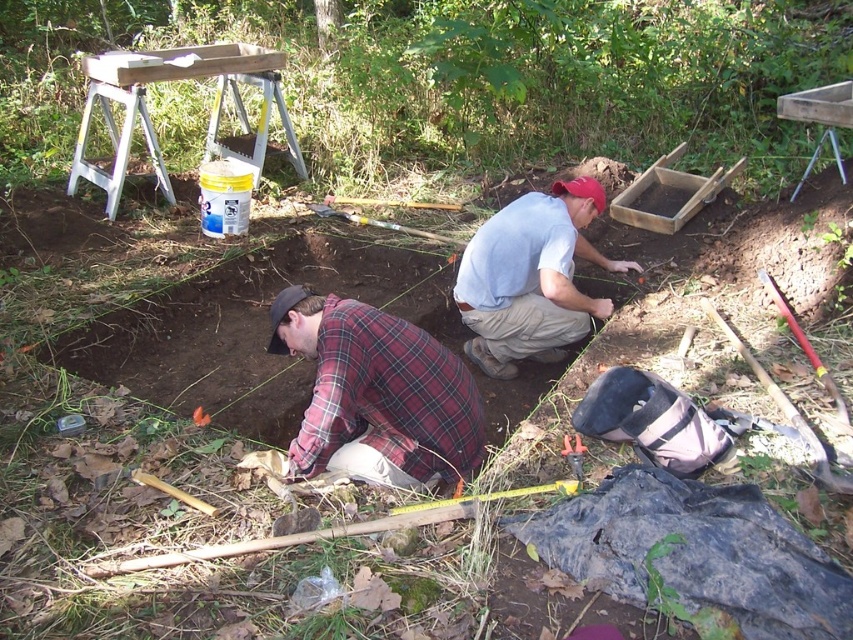
You are a photographer standing at the center of the excavation site. You want to take a photo that includes both the plaid fabric shirt at lower left and the other person in the scene. Which direction should you move to ensure both are in the frame?

To include both the plaid fabric shirt at lower left and the other person in the frame, you should move to the right since the plaid fabric shirt at lower left is located at point (376, 394), which is towards the lower left side of the image. Moving right would center the photographer between both individuals, ensuring both are captured in the frame.

Based on the coordinates provided, which object in the scene is located at point (376, 394)?

The point (376, 394) corresponds to the plaid fabric shirt at lower left.

You are an archaeologist who needs to identify the correct tool for a task. You have a white cotton shirt at center and a metallic silver hammer at lower center. Which item is bigger?

The white cotton shirt at center is larger in size than the metallic silver hammer at lower center, so the white cotton shirt at center is bigger.